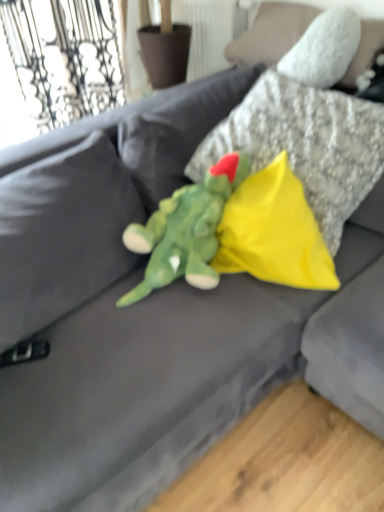
Question: Does yellow fabric pillow at center, positioned as the 1th pillow in bottom-to-top order, lie behind yellow fabric pillow at center, the 2th pillow from the bottom?

Choices:
 (A) yes
 (B) no

Answer: (A)

Question: From the image's perspective, is yellow fabric pillow at center, positioned as the 1th pillow in bottom-to-top order, on top of yellow fabric pillow at center, the 2th pillow from the bottom?

Choices:
 (A) yes
 (B) no

Answer: (B)

Question: Is yellow fabric pillow at center, which is counted as the second pillow, starting from the top, in front of yellow fabric pillow at center, the 2th pillow from the bottom?

Choices:
 (A) no
 (B) yes

Answer: (A)

Question: Is yellow fabric pillow at center, which is counted as the second pillow, starting from the top, next to yellow fabric pillow at center, the 2th pillow from the bottom, and touching it?

Choices:
 (A) yes
 (B) no

Answer: (B)

Question: From a real-world perspective, is yellow fabric pillow at center, which is counted as the second pillow, starting from the top, physically below yellow fabric pillow at center, the 1th pillow viewed from the top?

Choices:
 (A) yes
 (B) no

Answer: (A)

Question: From a real-world perspective, relative to yellow fabric pillow at center, the 1th pillow viewed from the top, is soft plush dinosaur at center vertically above or below?

Choices:
 (A) above
 (B) below

Answer: (B)

Question: Is soft plush dinosaur at center in front of or behind yellow fabric pillow at center, the 2th pillow from the bottom, in the image?

Choices:
 (A) front
 (B) behind

Answer: (A)

Question: From the image's perspective, relative to yellow fabric pillow at center, the 1th pillow viewed from the top, is soft plush dinosaur at center above or below?

Choices:
 (A) below
 (B) above

Answer: (A)

Question: Does point (193, 215) appear closer or farther from the camera than point (276, 110)?

Choices:
 (A) closer
 (B) farther

Answer: (A)

Question: From the image's perspective, is yellow fabric pillow at center, the 2th pillow from the bottom, above or below soft plush dinosaur at center?

Choices:
 (A) above
 (B) below

Answer: (A)

Question: Would you say yellow fabric pillow at center, the 2th pillow from the bottom, is to the left or to the right of soft plush dinosaur at center in the picture?

Choices:
 (A) left
 (B) right

Answer: (B)

Question: From a real-world perspective, is yellow fabric pillow at center, the 2th pillow from the bottom, positioned above or below soft plush dinosaur at center?

Choices:
 (A) below
 (B) above

Answer: (B)

Question: Considering their positions, is yellow fabric pillow at center, the 1th pillow viewed from the top, located in front of or behind soft plush dinosaur at center?

Choices:
 (A) behind
 (B) front

Answer: (A)

Question: Is point (309, 286) closer or farther from the camera than point (148, 279)?

Choices:
 (A) closer
 (B) farther

Answer: (A)

Question: In the image, is yellow fabric pillow at center, positioned as the 1th pillow in bottom-to-top order, positioned in front of or behind soft plush dinosaur at center?

Choices:
 (A) front
 (B) behind

Answer: (B)